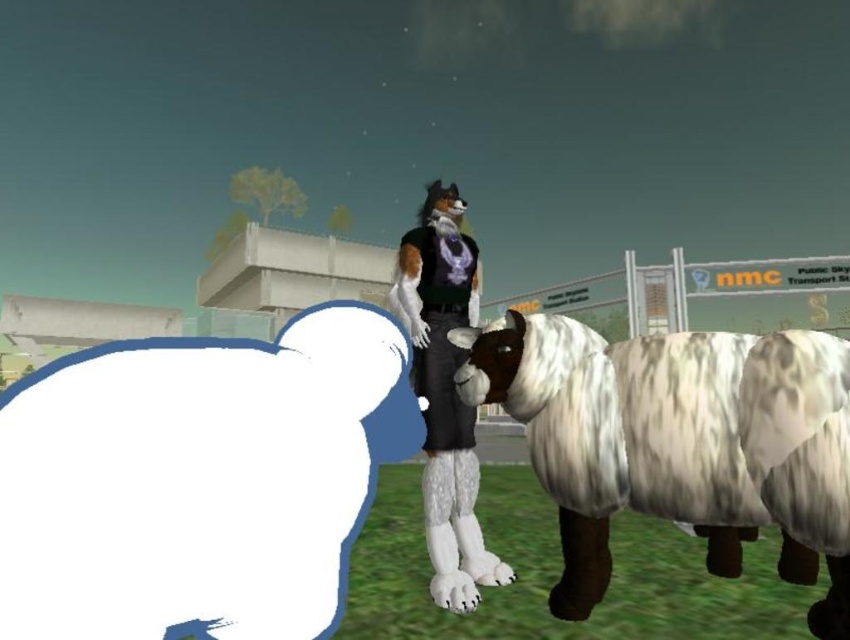
Does white fur sheep at left have a lesser height compared to white woolen sheep at right?

Yes.

Between point (338, 380) and point (601, 374), which one is positioned in front?

Point (338, 380) is more forward.

The image size is (850, 640). In order to click on white fur sheep at left in this screenshot , I will do `click(197, 480)`.

Who is lower down, white fur sheep at left or fuzzy fur outfit at center?

Answer: white fur sheep at left is lower down.

Does point (191, 579) come behind point (426, 280)?

That is False.

Does point (31, 403) lie behind point (476, 582)?

No, (31, 403) is closer to viewer.

The width and height of the screenshot is (850, 640). Find the location of `white fur sheep at left`. white fur sheep at left is located at coordinates (197, 480).

Between point (585, 429) and point (438, 492), which one is positioned in front?

Point (585, 429) is in front.

Who is shorter, white woolen sheep at right or fuzzy fur outfit at center?

white woolen sheep at right is shorter.

Who is more forward, (479, 392) or (479, 545)?

Point (479, 392) is in front.

At what (x,y) coordinates should I click in order to perform the action: click on white woolen sheep at right. Please return your answer as a coordinate pair (x, y). Looking at the image, I should click on (678, 442).